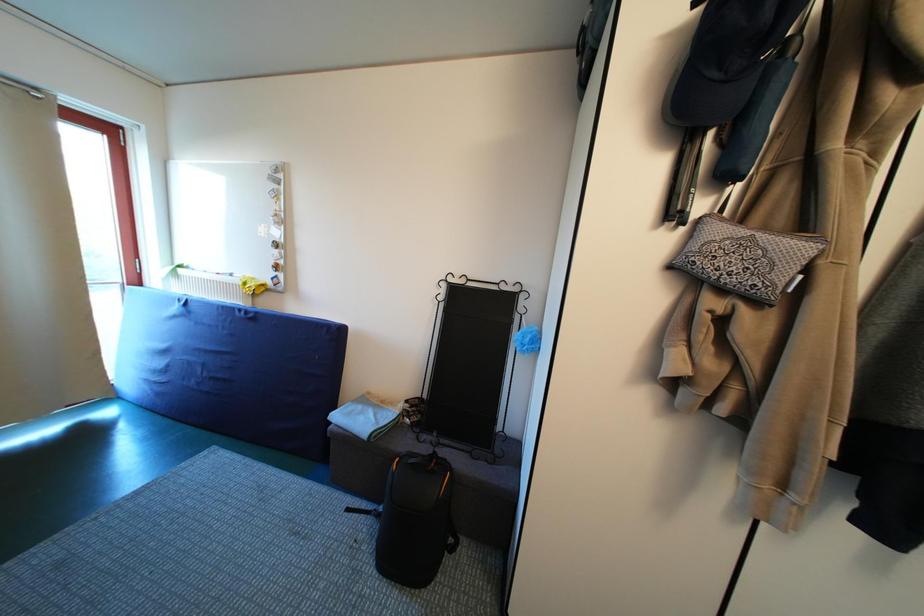
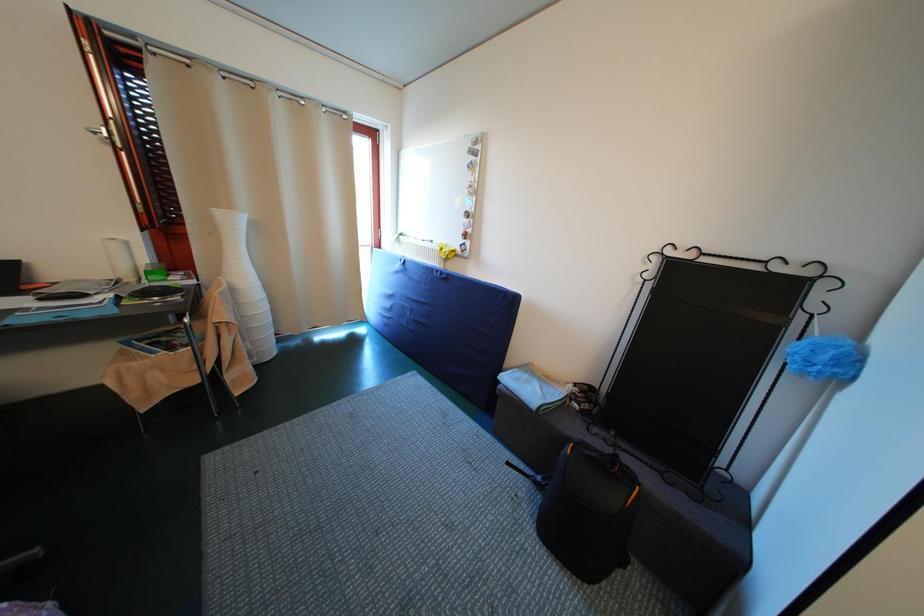
Question: The camera is either moving clockwise (left) or counter-clockwise (right) around the object. The first image is from the beginning of the video and the second image is from the end. Is the camera moving left or right when shooting the video?

Choices:
 (A) Left
 (B) Right

Answer: (B)